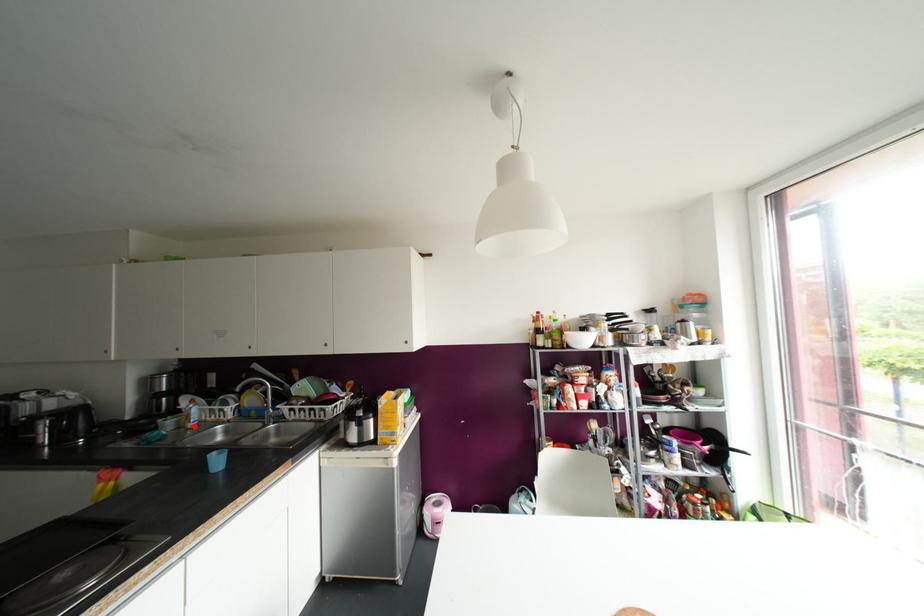
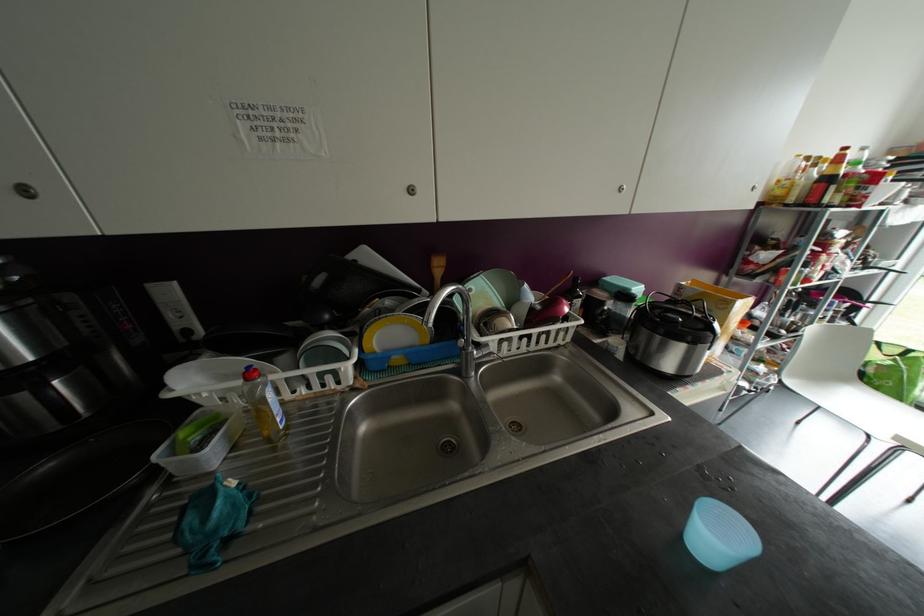
Locate, in the second image, the point that corresponds to the highlighted location in the first image.

(286, 427)